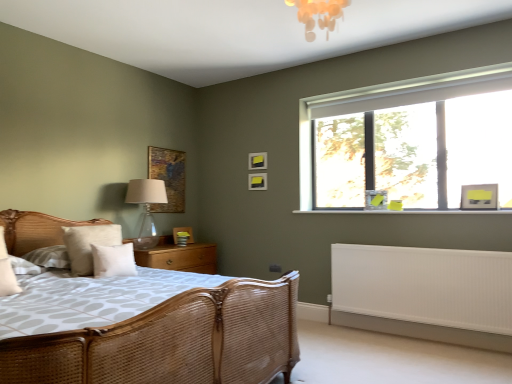
This screenshot has width=512, height=384. In order to click on free space in front of wooden picture frame at lower center, which appears as the fifth picture frame when viewed from the front in this screenshot , I will do `click(180, 243)`.